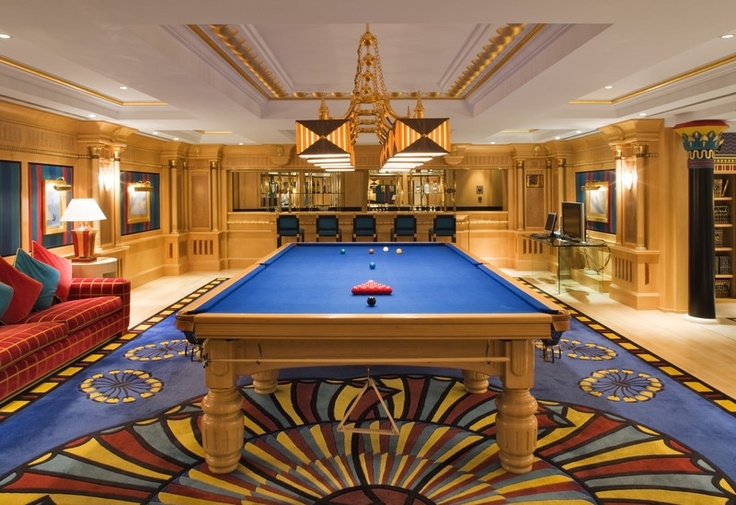
Locate an element on the screen. Image resolution: width=736 pixels, height=505 pixels. hanging ceiling lights is located at coordinates tap(372, 42), tap(371, 60), tap(372, 79), tap(364, 97), tap(364, 114), tap(363, 120), tap(371, 127).